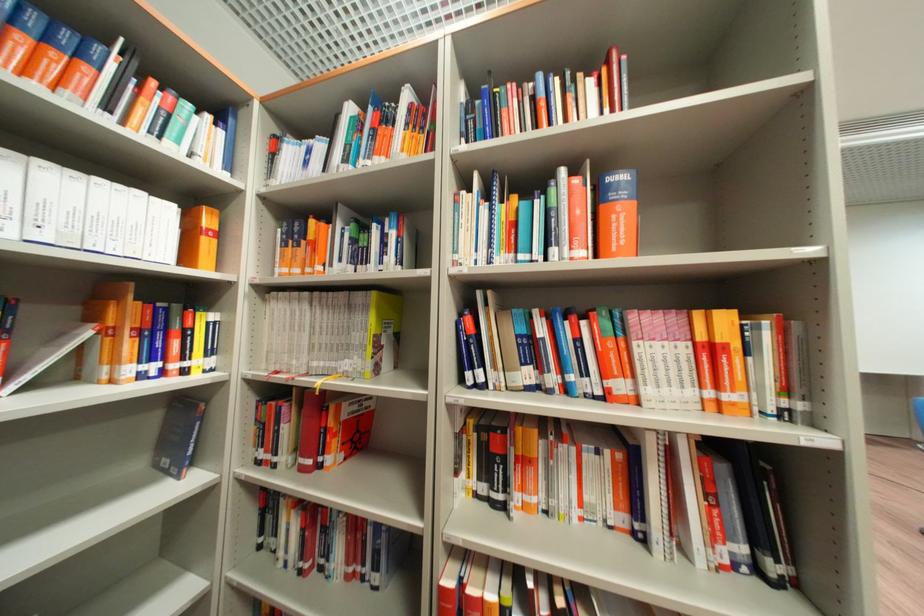
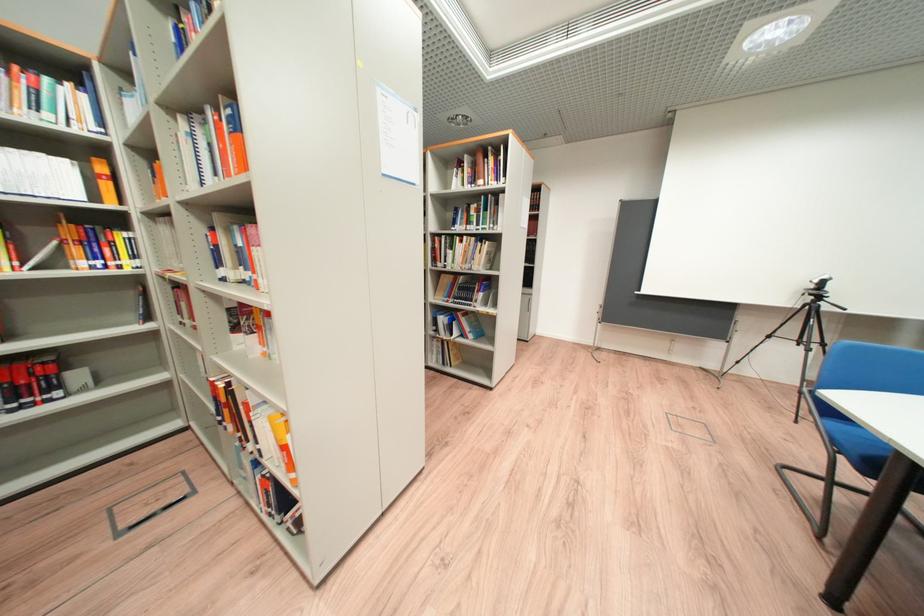
Question: Which direction would the cameraman need to move to produce the second image? Reply with the corresponding letter.

Choices:
 (A) Left
 (B) Right
 (C) Forward
 (D) Backward

Answer: (B)